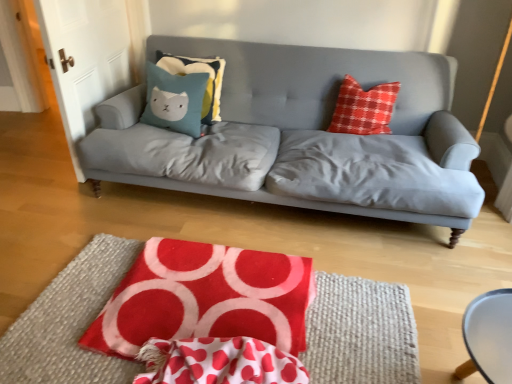
Locate an element on the screen. blank space situated above red felt rug at center (from a real-world perspective) is located at coordinates (192, 309).